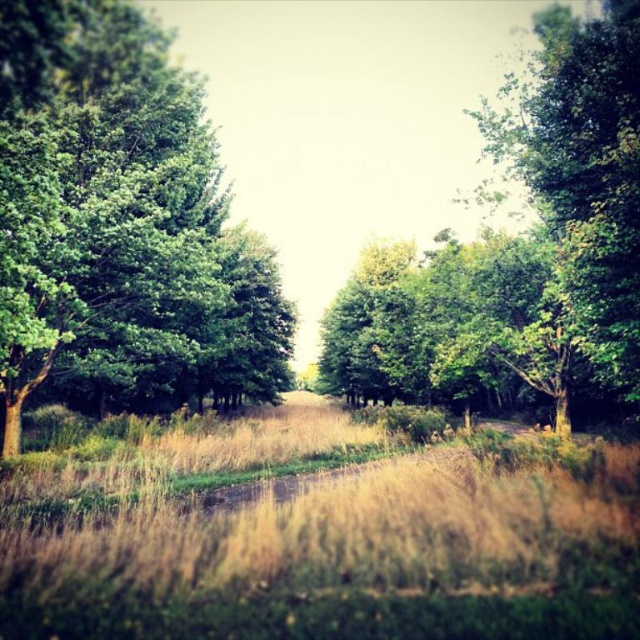
Question: Does green leafy tree at left appear on the right side of green leafy tree at center?

Choices:
 (A) yes
 (B) no

Answer: (B)

Question: Which object is the farthest from the green leafy tree at center?

Choices:
 (A) dry grass at center
 (B) green leafy tree at left

Answer: (A)

Question: Which point is closer to the camera?

Choices:
 (A) (296, 625)
 (B) (600, 189)
 (C) (148, 388)

Answer: (A)

Question: Does green leafy tree at left appear on the right side of green leafy tree at center?

Choices:
 (A) no
 (B) yes

Answer: (A)

Question: Does green leafy tree at left have a larger size compared to green leafy tree at center?

Choices:
 (A) no
 (B) yes

Answer: (A)

Question: Which object is positioned farthest from the green leafy tree at left?

Choices:
 (A) green leafy tree at center
 (B) dry grass at center

Answer: (A)